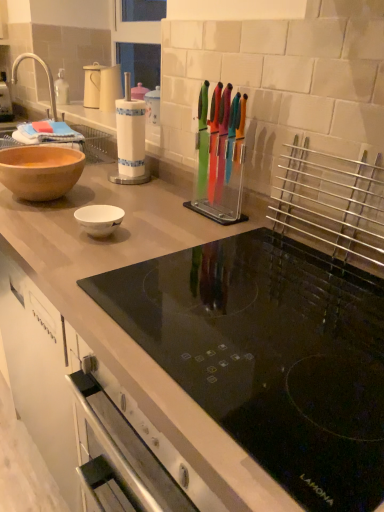
What do you see at coordinates (40, 170) in the screenshot? I see `matte brown bowl at left` at bounding box center [40, 170].

The height and width of the screenshot is (512, 384). What do you see at coordinates (102, 86) in the screenshot?
I see `matte white container at upper left` at bounding box center [102, 86].

The height and width of the screenshot is (512, 384). What do you see at coordinates (221, 166) in the screenshot? I see `transparent plastic knife block at center, arranged as the 2th appliance when viewed from the back` at bounding box center [221, 166].

The height and width of the screenshot is (512, 384). What are the coordinates of `matte brown bowl at left` in the screenshot? It's located at click(40, 170).

Is matte brown bowl at left oriented towards transparent plastic knife block at center, which ranks as the 1th appliance in front-to-back order?

No, matte brown bowl at left does not turn towards transparent plastic knife block at center, which ranks as the 1th appliance in front-to-back order.

Considering the relative positions of matte brown bowl at left and transparent plastic knife block at center, marked as the 2th appliance in a left-to-right arrangement, in the image provided, is matte brown bowl at left behind transparent plastic knife block at center, marked as the 2th appliance in a left-to-right arrangement,?

Yes, it is behind transparent plastic knife block at center, marked as the 2th appliance in a left-to-right arrangement.

Measure the distance from matte brown bowl at left to transparent plastic knife block at center, arranged as the 2th appliance when viewed from the back.

matte brown bowl at left and transparent plastic knife block at center, arranged as the 2th appliance when viewed from the back, are 17.00 inches apart.

Does matte brown bowl at left touch transparent plastic knife block at center, placed as the 1th appliance when sorted from right to left?

There is a gap between matte brown bowl at left and transparent plastic knife block at center, placed as the 1th appliance when sorted from right to left.

Is matte brown bowl at left inside the boundaries of white paper towel holder at center, the first appliance positioned from the left, or outside?

matte brown bowl at left is not inside white paper towel holder at center, the first appliance positioned from the left, it's outside.

How different are the orientations of matte brown bowl at left and white paper towel holder at center, the 1th appliance in the back-to-front sequence, in degrees?

The angular difference between matte brown bowl at left and white paper towel holder at center, the 1th appliance in the back-to-front sequence, is 0.785 degrees.

Considering the sizes of objects matte brown bowl at left and white paper towel holder at center, the first appliance positioned from the left, in the image provided, who is taller, matte brown bowl at left or white paper towel holder at center, the first appliance positioned from the left,?

Standing taller between the two is white paper towel holder at center, the first appliance positioned from the left.

Does matte white container at upper left appear on the right side of transparent plastic knife block at center, which ranks as the 1th appliance in front-to-back order?

No.

From the image's perspective, is matte white container at upper left above transparent plastic knife block at center, placed as the 1th appliance when sorted from right to left?

Yes.

Is matte white container at upper left inside or outside of transparent plastic knife block at center, placed as the 1th appliance when sorted from right to left?

matte white container at upper left is outside transparent plastic knife block at center, placed as the 1th appliance when sorted from right to left.

Does matte white container at upper left have a lesser width compared to transparent plastic knife block at center, which ranks as the 1th appliance in front-to-back order?

No.

From a real-world perspective, is matte white container at upper left physically below white paper towel holder at center, the 1th appliance in the back-to-front sequence?

Incorrect, from a real-world perspective, matte white container at upper left is higher than white paper towel holder at center, the 1th appliance in the back-to-front sequence.

Does matte white container at upper left have a smaller size compared to white paper towel holder at center, the first appliance positioned from the left?

Yes.

Would you say matte white container at upper left is to the left or to the right of white paper towel holder at center, the 1th appliance in the back-to-front sequence, in the picture?

matte white container at upper left is to the left of white paper towel holder at center, the 1th appliance in the back-to-front sequence.

How far apart are matte white container at upper left and white paper towel holder at center, the first appliance positioned from the left?

matte white container at upper left is 26.89 inches from white paper towel holder at center, the first appliance positioned from the left.

Is transparent plastic knife block at center, which ranks as the 1th appliance in front-to-back order, positioned behind matte brown bowl at left?

No.

From a real-world perspective, is transparent plastic knife block at center, arranged as the 2th appliance when viewed from the back, physically above matte brown bowl at left?

Yes.

Is transparent plastic knife block at center, arranged as the 2th appliance when viewed from the back, thinner than matte brown bowl at left?

Yes, transparent plastic knife block at center, arranged as the 2th appliance when viewed from the back, is thinner than matte brown bowl at left.

From the image's perspective, which one is positioned higher, brushed metal faucet at upper left or transparent plastic knife block at center, arranged as the 2th appliance when viewed from the back?

brushed metal faucet at upper left, from the image's perspective.

Visually, is brushed metal faucet at upper left positioned to the left or to the right of transparent plastic knife block at center, arranged as the 2th appliance when viewed from the back?

brushed metal faucet at upper left is positioned on transparent plastic knife block at center, arranged as the 2th appliance when viewed from the back,'s left side.

You are a GUI agent. You are given a task and a screenshot of the screen. Output one action in this format:
    pyautogui.click(x=<x>, y=<y>)
    Task: Click on the tap behind the transparent plastic knife block at center, placed as the 1th appliance when sorted from right to left
    
    Given the screenshot: What is the action you would take?
    pyautogui.click(x=45, y=72)

Is brushed metal faucet at upper left located outside transparent plastic knife block at center, which ranks as the 1th appliance in front-to-back order?

Yes, brushed metal faucet at upper left is located beyond the bounds of transparent plastic knife block at center, which ranks as the 1th appliance in front-to-back order.

Identify the location of kitchen appliance that appears behind the brushed metal faucet at upper left. The width and height of the screenshot is (384, 512). pyautogui.click(x=102, y=86).

What's the angular difference between brushed metal faucet at upper left and matte white container at upper left's facing directions?

There is a 1.62-degree angle between the facing directions of brushed metal faucet at upper left and matte white container at upper left.

From a real-world perspective, is brushed metal faucet at upper left on matte white container at upper left?

No, from a real-world perspective, brushed metal faucet at upper left is not on top of matte white container at upper left.

Could you tell me if brushed metal faucet at upper left is facing matte white container at upper left?

No, brushed metal faucet at upper left is not facing towards matte white container at upper left.

This screenshot has width=384, height=512. In the image, there is a transparent plastic knife block at center, arranged as the 2th appliance when viewed from the back. In order to click on bowl below it (from a real-world perspective) in this screenshot , I will do `click(40, 170)`.

I want to click on bowl lying below the white paper towel holder at center, the 1th appliance in the back-to-front sequence (from the image's perspective), so click(x=40, y=170).

Considering their positions, is transparent plastic knife block at center, which ranks as the 1th appliance in front-to-back order, positioned closer to matte white container at upper left than brushed metal faucet at upper left?

The object closer to matte white container at upper left is brushed metal faucet at upper left.

Which object lies further to the anchor point matte brown bowl at left, transparent plastic knife block at center, placed as the 1th appliance when sorted from right to left, or matte white container at upper left?

matte white container at upper left lies further to matte brown bowl at left than the other object.

Considering their positions, is white paper towel holder at center, the 1th appliance in the back-to-front sequence, positioned closer to transparent plastic knife block at center, which ranks as the 1th appliance in front-to-back order, than brushed metal faucet at upper left?

white paper towel holder at center, the 1th appliance in the back-to-front sequence, is closer to transparent plastic knife block at center, which ranks as the 1th appliance in front-to-back order.

Looking at the image, which one is located further to white paper towel holder at center, the first appliance positioned from the left, matte white container at upper left or transparent plastic knife block at center, placed as the 1th appliance when sorted from right to left?

Based on the image, matte white container at upper left appears to be further to white paper towel holder at center, the first appliance positioned from the left.

Consider the image. Looking at the image, which one is located further to matte brown bowl at left, matte white container at upper left or transparent plastic knife block at center, arranged as the 2th appliance when viewed from the back?

matte white container at upper left is further to matte brown bowl at left.

Consider the image. Based on their spatial positions, is matte brown bowl at left or brushed metal faucet at upper left further from matte white container at upper left?

matte brown bowl at left lies further to matte white container at upper left than the other object.

Looking at this image, estimate the real-world distances between objects in this image. Which object is closer to matte white container at upper left, white paper towel holder at center, which is counted as the second appliance, starting from the front, or transparent plastic knife block at center, arranged as the 2th appliance when viewed from the back?

Based on the image, white paper towel holder at center, which is counted as the second appliance, starting from the front, appears to be nearer to matte white container at upper left.

Looking at the image, which one is located closer to matte brown bowl at left, matte white container at upper left or white paper towel holder at center, the 1th appliance in the back-to-front sequence?

white paper towel holder at center, the 1th appliance in the back-to-front sequence, lies closer to matte brown bowl at left than the other object.

Locate an element on the screen. The image size is (384, 512). appliance positioned between transparent plastic knife block at center, arranged as the 2th appliance when viewed from the back, and matte white container at upper left from near to far is located at coordinates (130, 139).

The width and height of the screenshot is (384, 512). I want to click on tap positioned between matte brown bowl at left and matte white container at upper left from near to far, so click(x=45, y=72).

In order to click on bowl positioned between transparent plastic knife block at center, arranged as the 2th appliance when viewed from the back, and matte white container at upper left from near to far in this screenshot , I will do `click(40, 170)`.

Locate an element on the screen. Image resolution: width=384 pixels, height=512 pixels. appliance between matte brown bowl at left and brushed metal faucet at upper left from front to back is located at coordinates (130, 139).